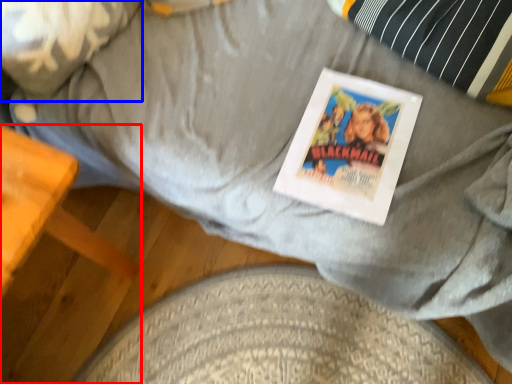
Question: Which of the following is the closest to the observer, furniture (highlighted by a red box) or pillow (highlighted by a blue box)?

Choices:
 (A) furniture
 (B) pillow

Answer: (A)